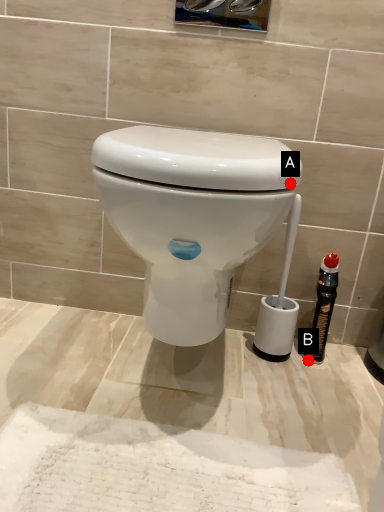
Question: Two points are circled on the image, labeled by A and B beside each circle. Which point is closer to the camera?

Choices:
 (A) A is closer
 (B) B is closer

Answer: (A)